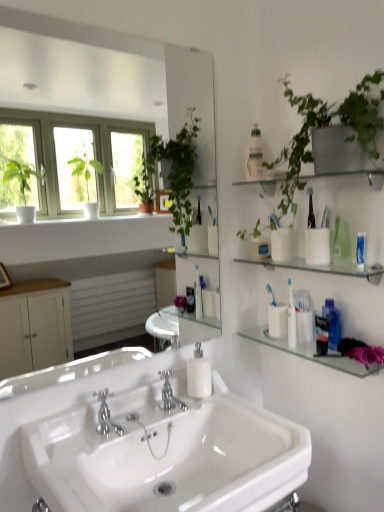
Question: Can you confirm if white matte cup at right, acting as the 2th toiletry starting from the left, is shorter than polished chrome faucet at center, which is the first tap in right-to-left order?

Choices:
 (A) no
 (B) yes

Answer: (B)

Question: Considering the relative sizes of white matte cup at right, acting as the 2th toiletry starting from the left, and polished chrome faucet at center, which is the first tap in right-to-left order, in the image provided, is white matte cup at right, acting as the 2th toiletry starting from the left, thinner than polished chrome faucet at center, which is the first tap in right-to-left order,?

Choices:
 (A) yes
 (B) no

Answer: (A)

Question: Does white matte cup at right, marked as the first toiletry in a right-to-left arrangement, have a larger size compared to polished chrome faucet at center, the first tap when ordered from back to front?

Choices:
 (A) yes
 (B) no

Answer: (B)

Question: From the image's perspective, is white matte cup at right, marked as the 2th toiletry in a top-to-bottom arrangement, above polished chrome faucet at center, which is the first tap in right-to-left order?

Choices:
 (A) yes
 (B) no

Answer: (A)

Question: Can you confirm if white matte cup at right, placed as the 1th toiletry when sorted from bottom to top, is wider than polished chrome faucet at center, which is the first tap in right-to-left order?

Choices:
 (A) yes
 (B) no

Answer: (B)

Question: Based on their sizes in the image, would you say white matte cup at right, acting as the 2th toiletry starting from the left, is bigger or smaller than white matte soap dispenser at center?

Choices:
 (A) big
 (B) small

Answer: (B)

Question: Is white matte cup at right, marked as the 2th toiletry in a top-to-bottom arrangement, inside or outside of white matte soap dispenser at center?

Choices:
 (A) outside
 (B) inside

Answer: (A)

Question: From a real-world perspective, is white matte cup at right, acting as the 2th toiletry starting from the left, physically located above or below white matte soap dispenser at center?

Choices:
 (A) below
 (B) above

Answer: (B)

Question: From the image's perspective, relative to white matte soap dispenser at center, is white matte cup at right, placed as the 1th toiletry when sorted from bottom to top, above or below?

Choices:
 (A) below
 (B) above

Answer: (B)

Question: From their relative heights in the image, would you say clear glass mirror at upper center is taller or shorter than chrome metallic faucet at center, arranged as the 2th tap when viewed from the back?

Choices:
 (A) short
 (B) tall

Answer: (B)

Question: From the image's perspective, is clear glass mirror at upper center above or below chrome metallic faucet at center, which is the second tap from right to left?

Choices:
 (A) above
 (B) below

Answer: (A)

Question: Is point (201, 148) closer or farther from the camera than point (97, 411)?

Choices:
 (A) closer
 (B) farther

Answer: (B)

Question: In the image, is clear glass mirror at upper center positioned in front of or behind chrome metallic faucet at center, which is the second tap from right to left?

Choices:
 (A) front
 (B) behind

Answer: (A)

Question: Is clear glass shelf at upper right, which appears as the second shelf when viewed from the top, bigger or smaller than clear glass mirror at upper center?

Choices:
 (A) big
 (B) small

Answer: (B)

Question: In terms of height, does clear glass shelf at upper right, which appears as the second shelf when viewed from the top, look taller or shorter compared to clear glass mirror at upper center?

Choices:
 (A) tall
 (B) short

Answer: (B)